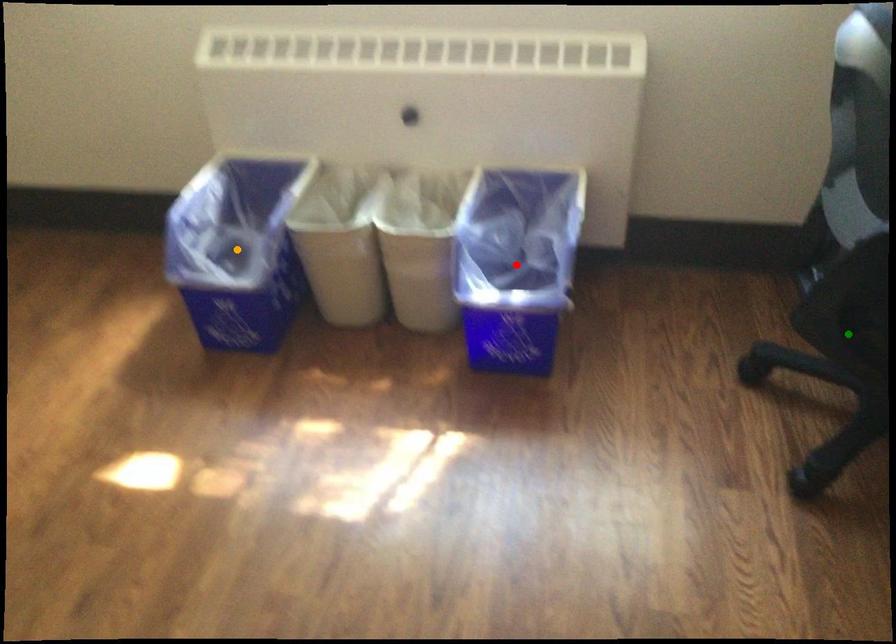
Order these from farthest to nearest:
red point | orange point | green point

red point < orange point < green point